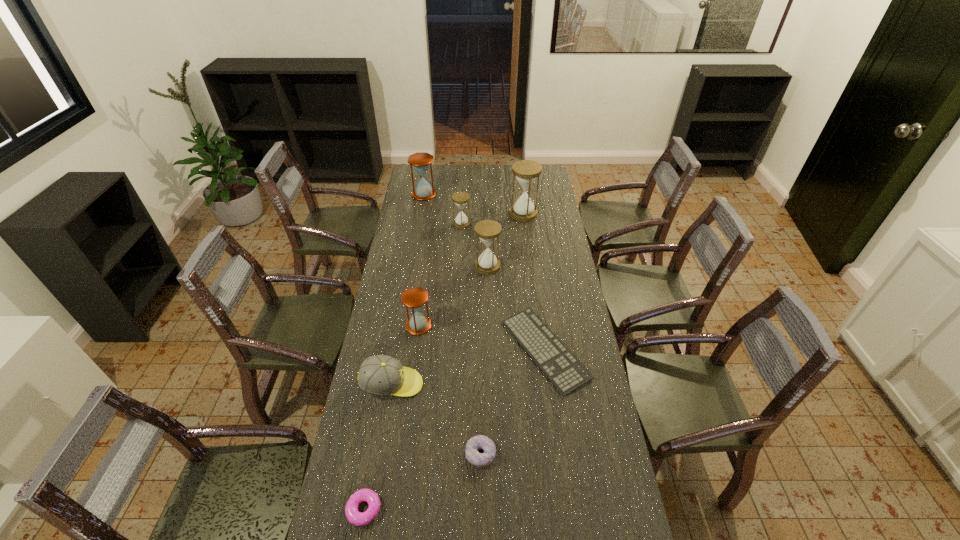
I want to click on the tallest object, so click(526, 171).

The width and height of the screenshot is (960, 540). I want to click on the rightmost hourglass, so click(526, 171).

Locate an element on the screen. the farther brown hourglass is located at coordinates (423, 191).

Locate an element on the screen. This screenshot has height=540, width=960. the bigger brown hourglass is located at coordinates (423, 191).

Image resolution: width=960 pixels, height=540 pixels. What are the coordinates of `the second nearest hourglass` in the screenshot? It's located at (487, 230).

Find the location of a particular element. The height and width of the screenshot is (540, 960). the nearest white hourglass is located at coordinates (487, 230).

Where is `the leftmost white hourglass`? the leftmost white hourglass is located at coordinates (461, 221).

The image size is (960, 540). Find the location of `the third hourglass from left to right`. the third hourglass from left to right is located at coordinates (461, 221).

Find the location of a particular element. The height and width of the screenshot is (540, 960). the smaller brown hourglass is located at coordinates (414, 298).

At what (x,y) coordinates should I click in order to perform the action: click on the nearer brown hourglass. Please return your answer as a coordinate pair (x, y). Looking at the image, I should click on (414, 298).